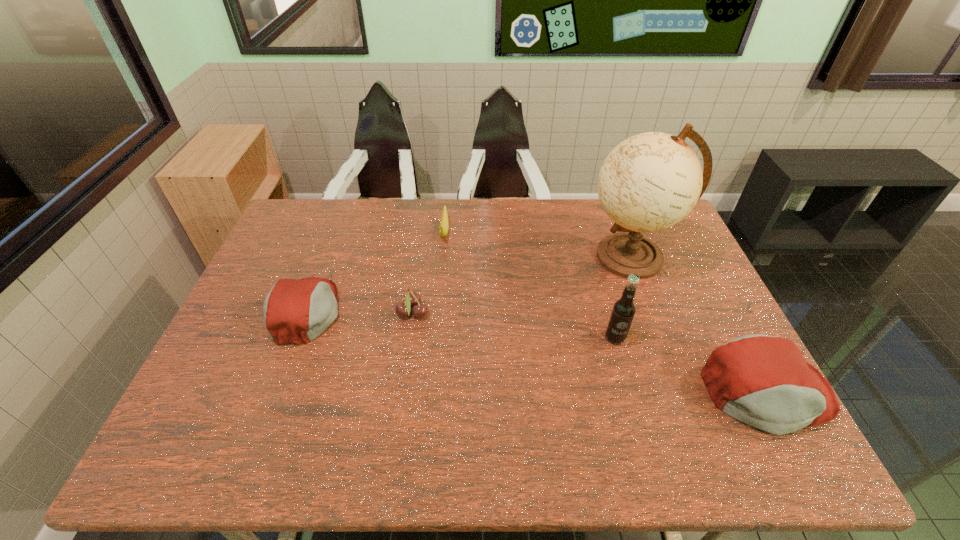
Find the location of a particular element. Image resolution: width=960 pixels, height=540 pixels. free space located 0.280m at the stem of the third object from left to right is located at coordinates (437, 310).

You are a GUI agent. You are given a task and a screenshot of the screen. Output one action in this format:
    pyautogui.click(x=<x>, y=<y>)
    Task: Click on the blank space located on the leaves of the second object from left to right
    
    Given the screenshot: What is the action you would take?
    pyautogui.click(x=524, y=313)

I want to click on vacant region located on the surface of the tallest object, so click(546, 257).

I want to click on blank space located 0.320m on the surface of the tallest object, so click(x=485, y=257).

The image size is (960, 540). I want to click on free region located 0.100m on the surface of the tallest object, so click(x=553, y=257).

Identify the location of free space located 0.180m on the label of the fifth shortest object. This screenshot has width=960, height=540. (635, 408).

You are a GUI agent. You are given a task and a screenshot of the screen. Output one action in this format:
    pyautogui.click(x=<x>, y=<y>)
    Task: Click on the banana located in the far edge section of the desktop
    The width and height of the screenshot is (960, 540).
    Given the screenshot: What is the action you would take?
    pyautogui.click(x=444, y=223)

At what (x,y) coordinates should I click in order to perform the action: click on globe present at the far edge. Please return your answer as a coordinate pair (x, y). The image size is (960, 540). Looking at the image, I should click on (651, 181).

Locate an element on the screen. The width and height of the screenshot is (960, 540). object positioned at the near edge is located at coordinates (763, 381).

Where is `object situated at the left edge`? object situated at the left edge is located at coordinates (295, 311).